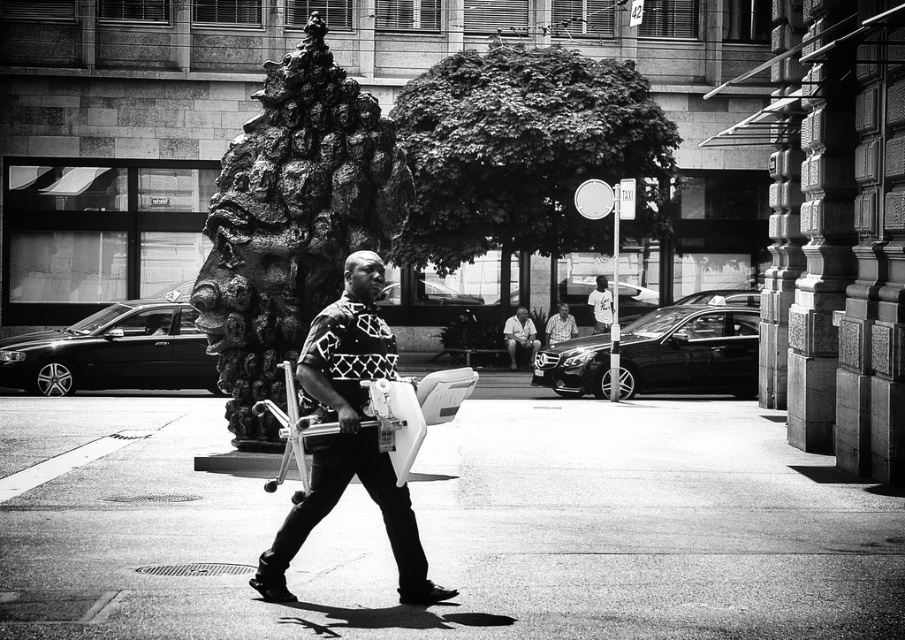
You are standing in the plaza and want to take a photo of the rough stone sculpture at center. If your camera can focus on objects up to 40 feet away, will you be able to capture a clear image?

The rough stone sculpture at center is 37.70 feet away from the viewer, which is within the camera focus range of up to 40 feet. Therefore, you can capture a clear image.